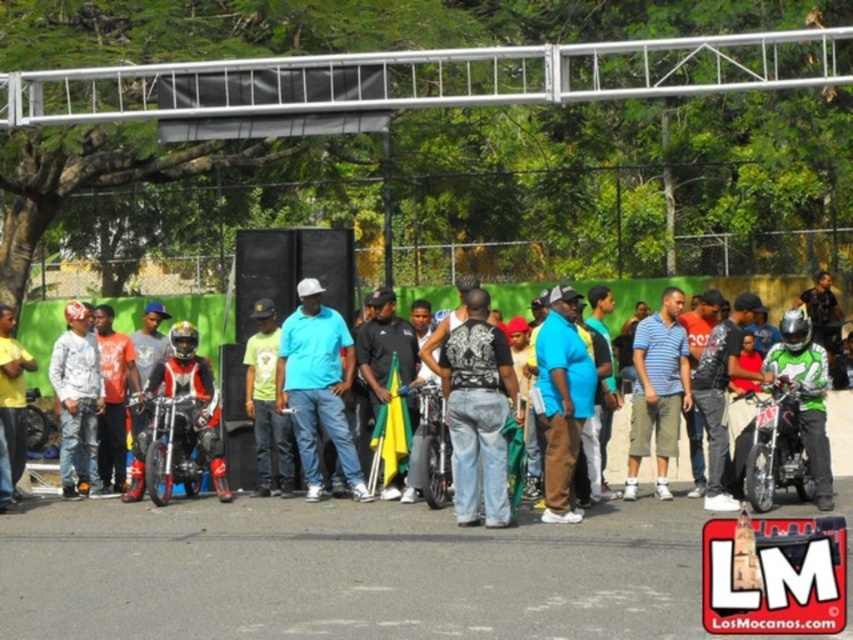
Question: Can you confirm if shiny metallic motorcycle at right is smaller than yellow t-shirt at center?

Choices:
 (A) no
 (B) yes

Answer: (B)

Question: Does matte black motorcycle at center appear on the left side of shiny metallic motorcycle at center?

Choices:
 (A) yes
 (B) no

Answer: (B)

Question: Which object is the closest to the yellow t-shirt at center?

Choices:
 (A) matte black motorcycle at center
 (B) shiny metallic motorcycle at right
 (C) shiny metallic motorcycle at center

Answer: (C)

Question: Is matte black motorcycle at center behind yellow t-shirt at center?

Choices:
 (A) yes
 (B) no

Answer: (A)

Question: Which point is farther from the camera taking this photo?

Choices:
 (A) (9, 330)
 (B) (782, 428)
 (C) (184, 404)

Answer: (A)

Question: Which point is farther from the camera taking this photo?

Choices:
 (A) (718, 284)
 (B) (9, 444)
 (C) (131, 483)

Answer: (A)